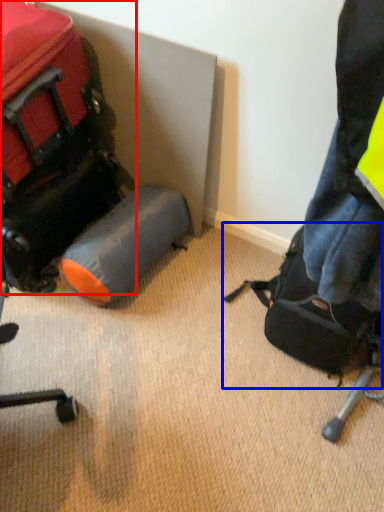
Question: Among these objects, which one is nearest to the camera, luggage and bags (highlighted by a red box) or luggage and bags (highlighted by a blue box)?

Choices:
 (A) luggage and bags
 (B) luggage and bags

Answer: (A)